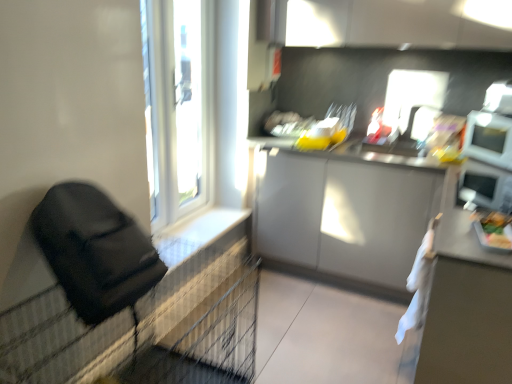
Question: Is green matte tray at right closer to the viewer compared to white glossy microwave at upper right?

Choices:
 (A) yes
 (B) no

Answer: (A)

Question: From a real-world perspective, is green matte tray at right under white glossy microwave at upper right?

Choices:
 (A) no
 (B) yes

Answer: (B)

Question: Is green matte tray at right located outside white glossy microwave at upper right?

Choices:
 (A) yes
 (B) no

Answer: (A)

Question: Does green matte tray at right have a larger size compared to white glossy microwave at upper right?

Choices:
 (A) yes
 (B) no

Answer: (B)

Question: Considering the relative sizes of green matte tray at right and white glossy microwave at upper right in the image provided, is green matte tray at right smaller than white glossy microwave at upper right?

Choices:
 (A) no
 (B) yes

Answer: (B)

Question: Does green matte tray at right have a lesser height compared to white glossy microwave at upper right?

Choices:
 (A) yes
 (B) no

Answer: (A)

Question: Is white plastic window frame at upper left behind white glossy microwave at upper right?

Choices:
 (A) yes
 (B) no

Answer: (A)

Question: Is white plastic window frame at upper left oriented away from white glossy microwave at upper right?

Choices:
 (A) no
 (B) yes

Answer: (A)

Question: Is white plastic window frame at upper left completely or partially outside of white glossy microwave at upper right?

Choices:
 (A) yes
 (B) no

Answer: (A)

Question: Can you confirm if white plastic window frame at upper left is bigger than white glossy microwave at upper right?

Choices:
 (A) yes
 (B) no

Answer: (A)

Question: From the image's perspective, is white plastic window frame at upper left on top of white glossy microwave at upper right?

Choices:
 (A) no
 (B) yes

Answer: (B)

Question: Is white glossy microwave at upper right located within white plastic window frame at upper left?

Choices:
 (A) yes
 (B) no

Answer: (B)

Question: Would you say white plastic window at upper left is a long distance from white plastic window frame at upper left?

Choices:
 (A) no
 (B) yes

Answer: (A)